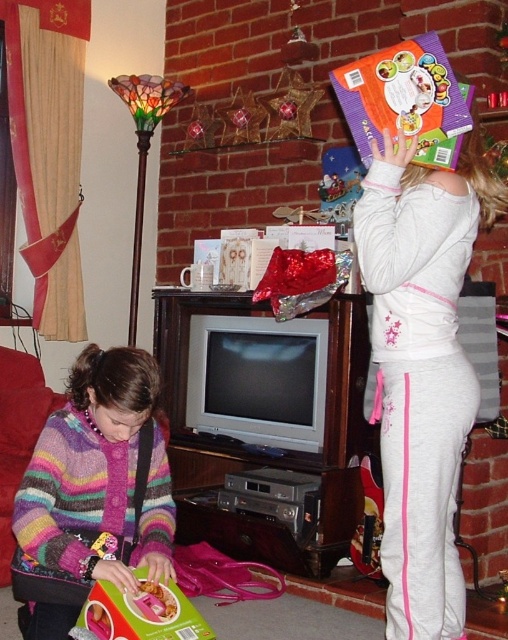
You are a guest at a holiday party and notice two boxes in the living room. You want to grab the matte pink box at lower left without disturbing the orange glossy cereal box at upper right. Can you reach it easily?

The orange glossy cereal box at upper right is located above the matte pink box at lower left, so you can easily reach the matte pink box at lower left without disturbing the one above it.

You are organizing a pantry and need to place the orange glossy cereal box at upper right and the matte pink box at lower left on a shelf. If the shelf has limited space, which box should you place first to ensure both fit?

You should place the orange glossy cereal box at upper right first because it has a smaller width than the matte pink box at lower left, allowing more space for the wider box afterward.

You are a gift delivery person who just arrived at the house. You see the striped wool sweater at lower left and the matte pink box at lower left. Which item is covering the other one?

The striped wool sweater at lower left is positioned over the matte pink box at lower left, so the sweater is covering the box.